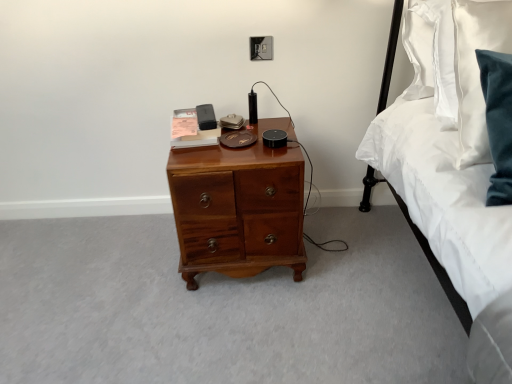
Where is `free space to the left of shiny brown wooden chest of drawers at center`? free space to the left of shiny brown wooden chest of drawers at center is located at coordinates (132, 262).